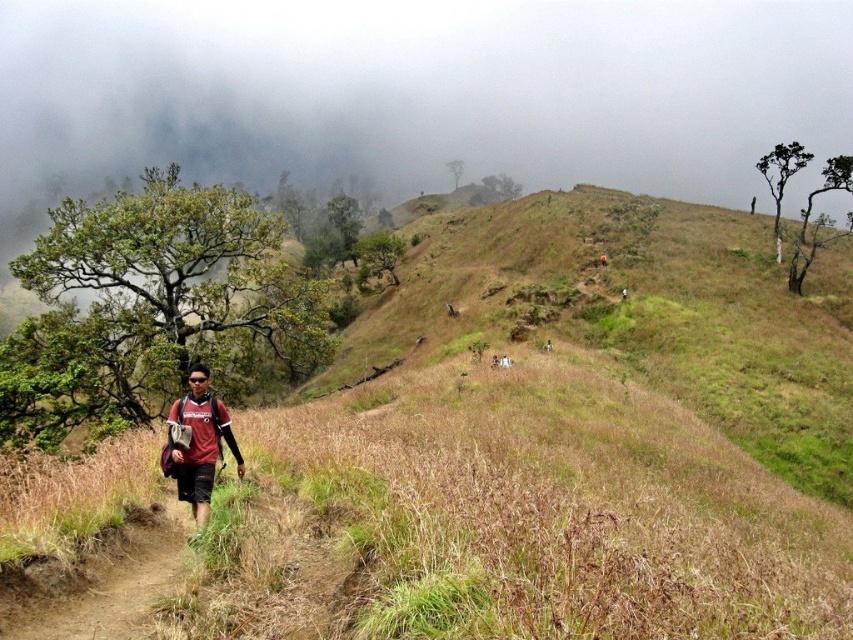
Between dry grass at center and matte red shirt at center, which one appears on the left side from the viewer's perspective?

From the viewer's perspective, matte red shirt at center appears more on the left side.

Does dry grass at center appear under matte red shirt at center?

No.

Where is `dry grass at center`? dry grass at center is located at coordinates (552, 444).

Where is `dry grass at center`? The height and width of the screenshot is (640, 853). dry grass at center is located at coordinates (552, 444).